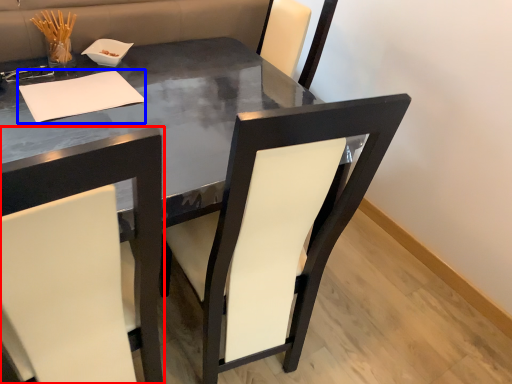
Question: Among these objects, which one is farthest to the camera, chair (highlighted by a red box) or notepad (highlighted by a blue box)?

Choices:
 (A) chair
 (B) notepad

Answer: (B)